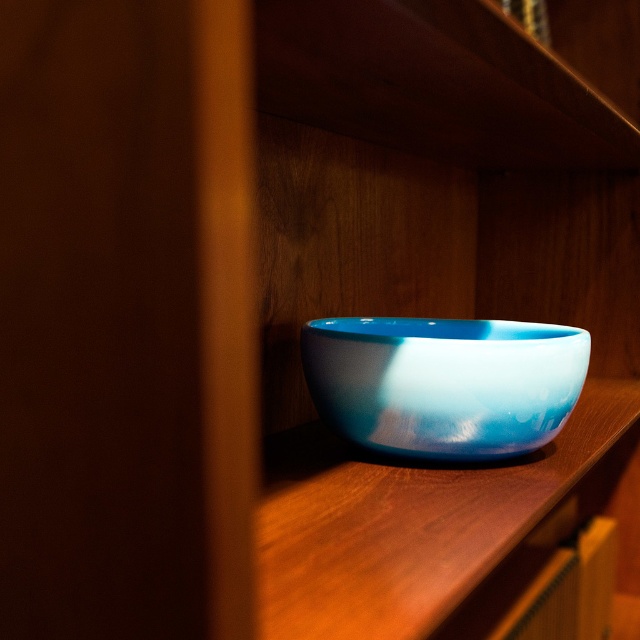
Question: Which of the following is the closest to the observer?

Choices:
 (A) blue glossy bowl at center
 (B) glossy ceramic bowl at center

Answer: (A)

Question: Does blue glossy bowl at center lie behind glossy ceramic bowl at center?

Choices:
 (A) yes
 (B) no

Answer: (B)

Question: From the image, what is the correct spatial relationship of blue glossy bowl at center in relation to glossy ceramic bowl at center?

Choices:
 (A) left
 (B) right

Answer: (B)

Question: Is the position of blue glossy bowl at center more distant than that of glossy ceramic bowl at center?

Choices:
 (A) no
 (B) yes

Answer: (A)